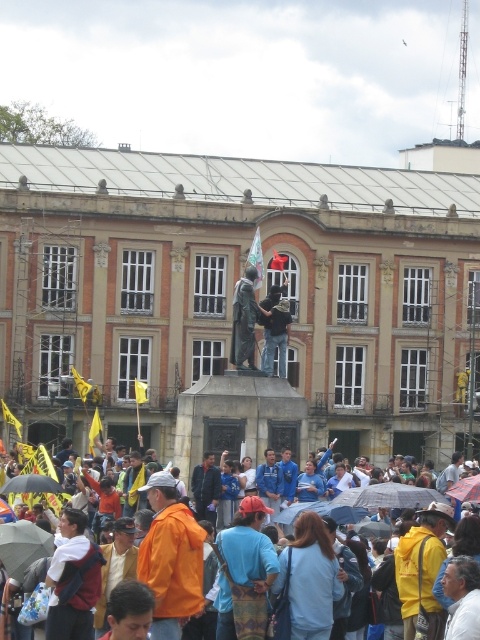
Which is behind, point (267, 504) or point (250, 316)?

The point (250, 316) is behind.

Between point (432, 531) and point (230, 362), which one is positioned in front?

Positioned in front is point (432, 531).

This screenshot has width=480, height=640. What are the coordinates of `blue fabric crowd at center` in the screenshot? It's located at (408, 499).

Is blue fabric crowd at center positioned before matte bronze statue at center?

Yes, it is.

Which is in front, point (446, 513) or point (271, 364)?

Point (446, 513)

Who is more distant from viewer, (252, 509) or (282, 308)?

The point (282, 308) is more distant.

Find the location of a particular element. This screenshot has width=480, height=640. blue fabric crowd at center is located at coordinates (408, 499).

Is matte bronze statue at center to the right of transparent plastic umbrella at center from the viewer's perspective?

In fact, matte bronze statue at center is to the left of transparent plastic umbrella at center.

Which is more to the right, matte bronze statue at center or transparent plastic umbrella at center?

From the viewer's perspective, transparent plastic umbrella at center appears more on the right side.

Does point (264, 365) come closer to viewer compared to point (456, 492)?

No, it is behind (456, 492).

You are a GUI agent. You are given a task and a screenshot of the screen. Output one action in this format:
    pyautogui.click(x=<x>, y=<y>)
    Task: Click on the matte bronze statue at center
    The height and width of the screenshot is (640, 480).
    Given the screenshot: What is the action you would take?
    pyautogui.click(x=276, y=330)